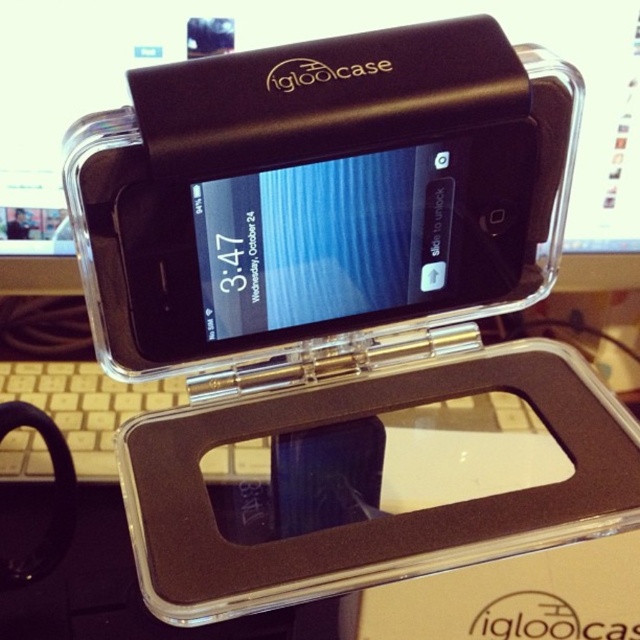
You are setting up a home office and have a desk with limited space. You need to place both the transparent plastic computer monitor at center and the beige plastic keyboard at lower left on the desk. Considering their sizes, which object should you place closer to the edge of the desk to save space?

The beige plastic keyboard at lower left should be placed closer to the edge of the desk because it is smaller in size than the transparent plastic computer monitor at center, allowing for better space conservation.

Looking at this image, you are holding the smartphone in your hand and notice two points on the case. The first point is at coordinate point [403,17] and the second point is at coordinate point [81,429]. Which point is closer to you?

Point [403,17] is closer to you because it is further to the viewer than point [81,429].